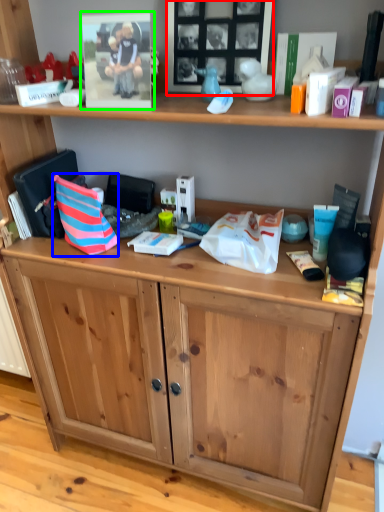
Question: Which object is the farthest from picture frame (highlighted by a red box)? Choose among these: handbag (highlighted by a blue box) or picture frame (highlighted by a green box).

Choices:
 (A) handbag
 (B) picture frame

Answer: (A)